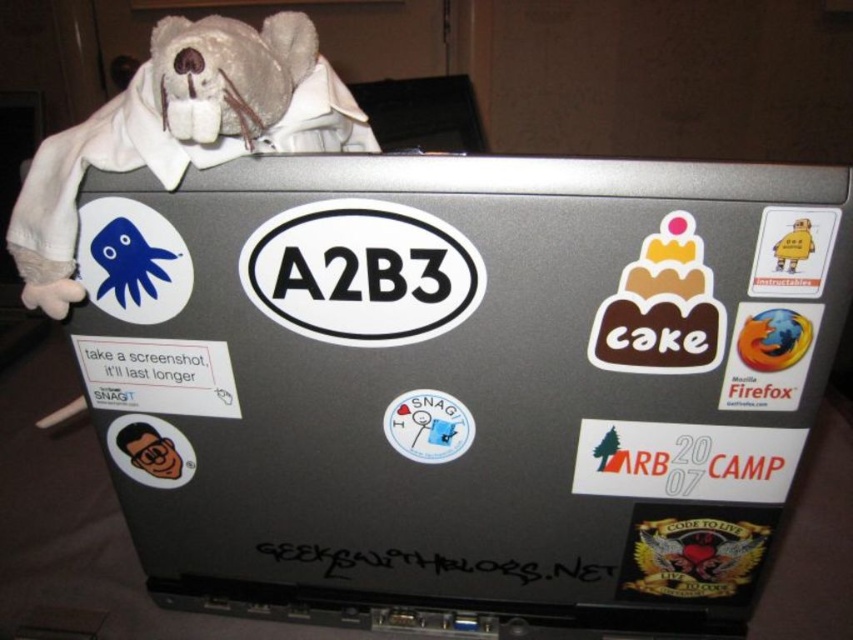
Can you confirm if metallic silver laptop at center is positioned below yellow paper man at upper right?

Yes.

Between point (352, 570) and point (781, 282), which one is positioned in front?

Point (781, 282)

Identify the location of metallic silver laptop at center. Image resolution: width=853 pixels, height=640 pixels. (463, 388).

Does blue matte sticker at upper left have a smaller size compared to firefox sticker at right?

Incorrect, blue matte sticker at upper left is not smaller in size than firefox sticker at right.

Can you confirm if blue matte sticker at upper left is positioned to the left of firefox sticker at right?

Correct, you'll find blue matte sticker at upper left to the left of firefox sticker at right.

Find the location of `blue matte sticker at upper left`. blue matte sticker at upper left is located at coordinates (132, 260).

Is metallic silver laptop at center to the right of firefox sticker at right from the viewer's perspective?

No, metallic silver laptop at center is not to the right of firefox sticker at right.

Does metallic silver laptop at center have a smaller size compared to firefox sticker at right?

Incorrect, metallic silver laptop at center is not smaller in size than firefox sticker at right.

Between point (699, 253) and point (798, 381), which one is positioned in front?

Point (699, 253)

Locate an element on the screen. This screenshot has height=640, width=853. metallic silver laptop at center is located at coordinates (463, 388).